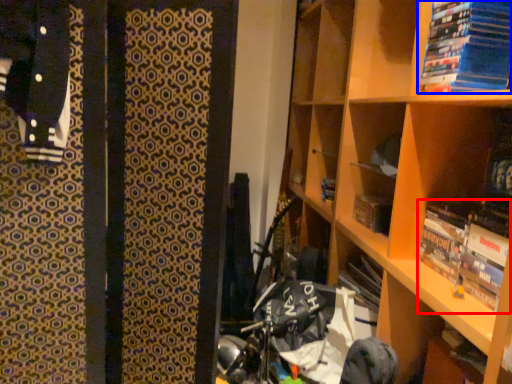
Question: Which of the following is the closest to the observer, book (highlighted by a red box) or book (highlighted by a blue box)?

Choices:
 (A) book
 (B) book

Answer: (B)